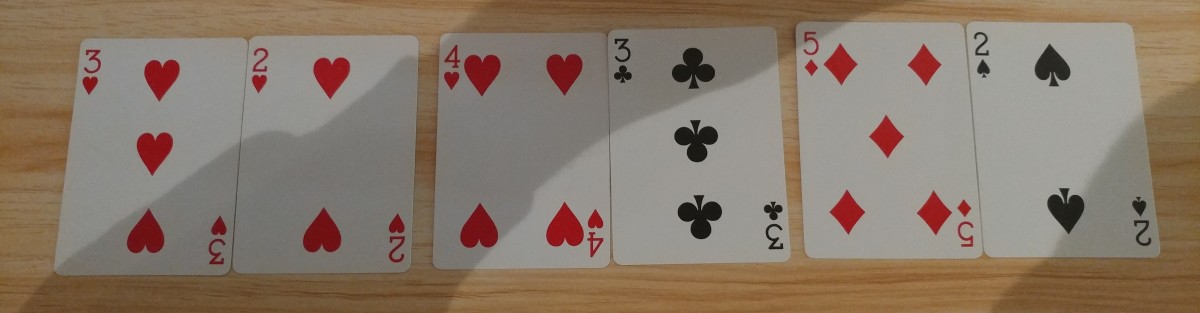
I want to click on table, so (x=661, y=276).